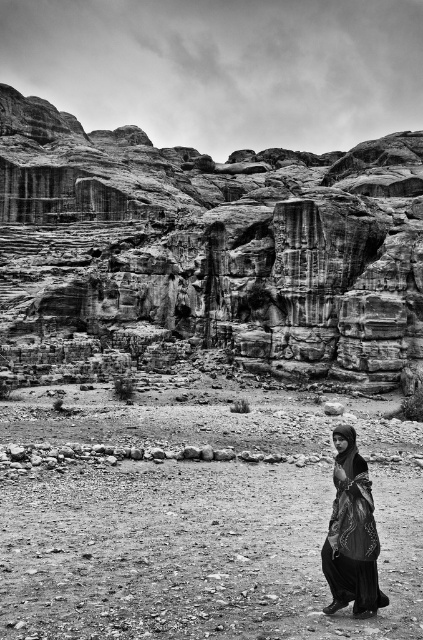
Based on the scene described, which object, the rugged stone cliffs at upper left or the dirt field at lower center, is taller?

The rugged stone cliffs at upper left are taller than the dirt field at lower center according to the description.

You are standing at the point marked by coordinates point (197, 522) in the desert scene. Looking around, you see the rugged desert landscape with layered rock formations and a person walking away in the lower right corner. What is directly beneath your feet at this location?

The point (197, 522) indicates dirt field at lower center, so the dirt field at lower center is directly beneath your feet at this location.

You are a photographer standing in the desert scene. You want to place a small marker at point (102, 321) and another at point (153, 588). Which marker will be closer to your camera?

The marker placed at point (102, 321) will be closer to the camera because it is further to the camera than point (153, 588).